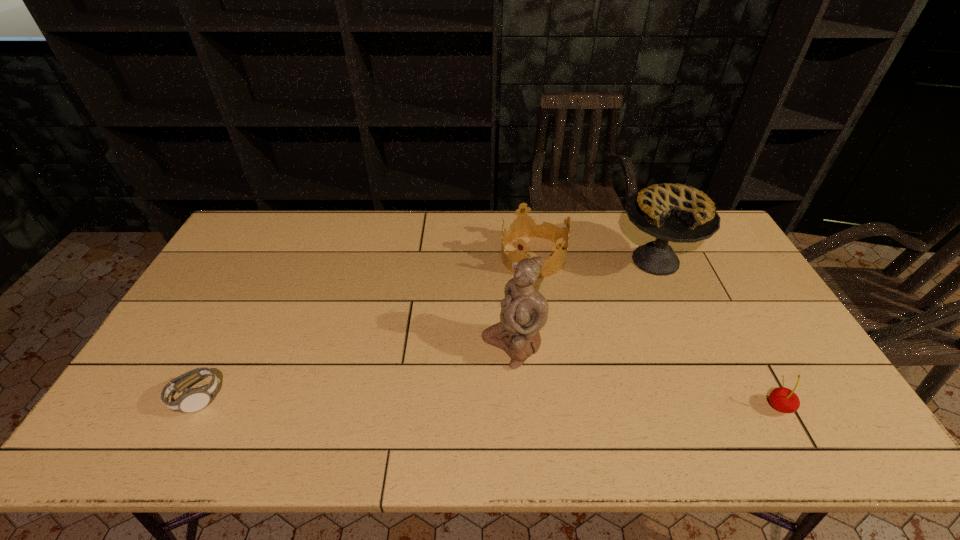
This screenshot has width=960, height=540. In order to click on vacant spot on the desktop that is between the shortest object and the cherry and is positioned on the front-facing side of the third nearest object in this screenshot , I will do `click(423, 401)`.

You are a GUI agent. You are given a task and a screenshot of the screen. Output one action in this format:
    pyautogui.click(x=<x>, y=<y>)
    Task: Click on the free space on the desktop that is between the shortest object and the fourth tallest object and is positioned on the front-facing side of the tiara
    
    Given the screenshot: What is the action you would take?
    pyautogui.click(x=425, y=401)

At what (x,y) coordinates should I click in order to perform the action: click on vacant space on the desktop that is between the watch and the fourth tallest object and is positioned on the cut side of the pie. Please return your answer as a coordinate pair (x, y). This screenshot has width=960, height=540. Looking at the image, I should click on (567, 403).